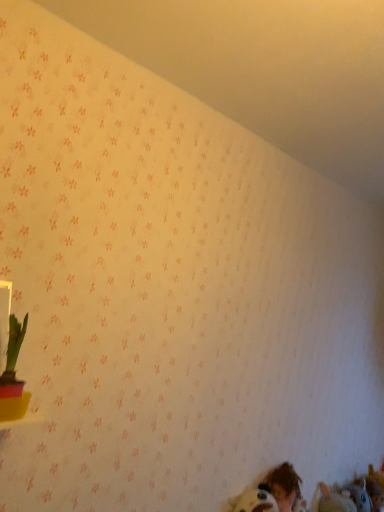
Question: From a real-world perspective, is brown plush toy at lower right, arranged as the 2th animal when viewed from the left, located higher than green leafy plant in pink pot at left?

Choices:
 (A) no
 (B) yes

Answer: (A)

Question: Is brown plush toy at lower right, which appears as the first animal when viewed from the right, at the right side of green leafy plant in pink pot at left?

Choices:
 (A) no
 (B) yes

Answer: (B)

Question: Can you confirm if brown plush toy at lower right, which is the second animal in front-to-back order, is smaller than green leafy plant in pink pot at left?

Choices:
 (A) no
 (B) yes

Answer: (A)

Question: Considering the relative sizes of brown plush toy at lower right, arranged as the 2th animal when viewed from the left, and green leafy plant in pink pot at left in the image provided, is brown plush toy at lower right, arranged as the 2th animal when viewed from the left, bigger than green leafy plant in pink pot at left?

Choices:
 (A) no
 (B) yes

Answer: (B)

Question: Is brown plush toy at lower right, which is counted as the 1th animal, starting from the back, further to camera compared to green leafy plant in pink pot at left?

Choices:
 (A) no
 (B) yes

Answer: (B)

Question: Does brown plush toy at lower right, arranged as the 2th animal when viewed from the left, have a lesser width compared to green leafy plant in pink pot at left?

Choices:
 (A) yes
 (B) no

Answer: (B)

Question: From a real-world perspective, is brown hair at lower right located beneath fuzzy brown stuffed toy at lower right, the second animal positioned from the right?

Choices:
 (A) no
 (B) yes

Answer: (A)

Question: Is fuzzy brown stuffed toy at lower right, marked as the 2th animal in a back-to-front arrangement, located within brown hair at lower right?

Choices:
 (A) yes
 (B) no

Answer: (B)

Question: Is brown hair at lower right thinner than fuzzy brown stuffed toy at lower right, marked as the 2th animal in a back-to-front arrangement?

Choices:
 (A) no
 (B) yes

Answer: (B)

Question: Is brown hair at lower right bigger than fuzzy brown stuffed toy at lower right, the 1th animal when ordered from left to right?

Choices:
 (A) yes
 (B) no

Answer: (A)

Question: Would you say brown hair at lower right is outside fuzzy brown stuffed toy at lower right, the 1th animal when ordered from left to right?

Choices:
 (A) no
 (B) yes

Answer: (B)

Question: Is brown hair at lower right far from fuzzy brown stuffed toy at lower right, the 1th animal when ordered from left to right?

Choices:
 (A) yes
 (B) no

Answer: (B)

Question: Does green leafy plant in pink pot at left come in front of fuzzy brown stuffed toy at lower right, marked as the 2th animal in a back-to-front arrangement?

Choices:
 (A) yes
 (B) no

Answer: (A)